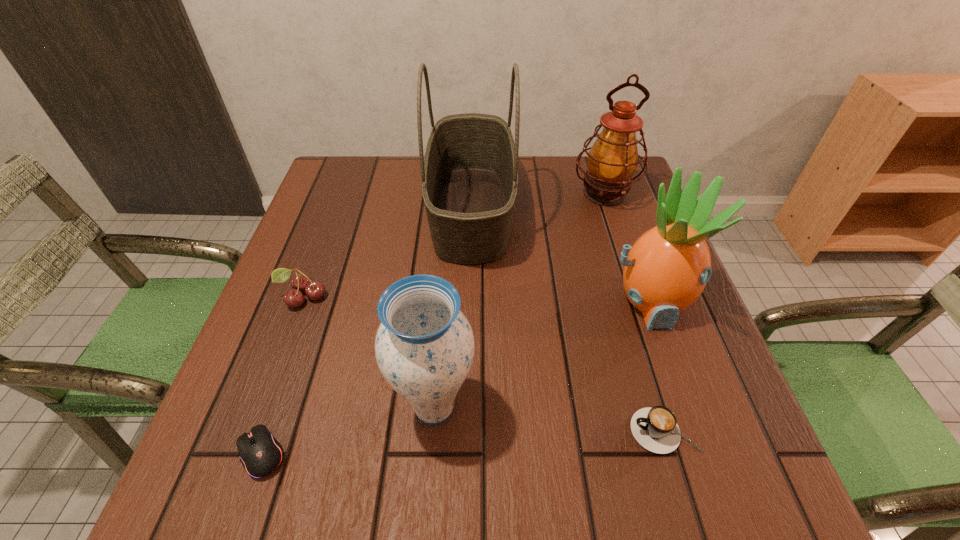
Locate an element on the screen. This screenshot has width=960, height=540. basket is located at coordinates (469, 173).

Where is `oil lamp`? The width and height of the screenshot is (960, 540). oil lamp is located at coordinates (612, 160).

Locate an element on the screen. The width and height of the screenshot is (960, 540). pineapple is located at coordinates (665, 271).

Find the location of `vase`. vase is located at coordinates (424, 347).

The image size is (960, 540). I want to click on the third shortest object, so click(x=300, y=283).

Identify the location of the sixth tallest object. [x=656, y=429].

The image size is (960, 540). I want to click on the shortest object, so click(260, 453).

Locate an element on the screen. The width and height of the screenshot is (960, 540). vacant space located on the front of the basket is located at coordinates (467, 432).

The image size is (960, 540). I want to click on vacant space located on the front of the oil lamp, so click(633, 280).

At what (x,y) coordinates should I click in order to perform the action: click on vacant space located at the entrance of the pineapple. Please return your answer as a coordinate pair (x, y). Looking at the image, I should click on (x=685, y=406).